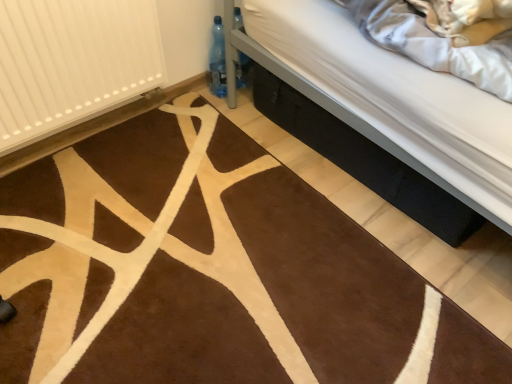
This screenshot has width=512, height=384. What do you see at coordinates (371, 91) in the screenshot?
I see `black fabric bed at lower right` at bounding box center [371, 91].

Identify the location of black fabric bed at lower right. (371, 91).

In order to face white ribbed radiator at left, should I rotate leftwards or rightwards?

You should rotate left by 22.180 degrees.

Measure the distance between point (58,4) and camera.

Point (58,4) and camera are 1.19 meters apart.

Where is `white ribbed radiator at left`? The height and width of the screenshot is (384, 512). white ribbed radiator at left is located at coordinates (72, 63).

Image resolution: width=512 pixels, height=384 pixels. What do you see at coordinates (72, 63) in the screenshot? I see `white ribbed radiator at left` at bounding box center [72, 63].

Locate an element on the screen. The width and height of the screenshot is (512, 384). black fabric bed at lower right is located at coordinates (371, 91).

From the picture: Considering the positions of objects black fabric bed at lower right and white ribbed radiator at left in the image provided, who is more to the left, black fabric bed at lower right or white ribbed radiator at left?

white ribbed radiator at left.

Who is more distant, black fabric bed at lower right or white ribbed radiator at left?

black fabric bed at lower right is behind.

Which is in front, point (304, 60) or point (32, 20)?

The point (32, 20) is closer to the camera.

From the image's perspective, between black fabric bed at lower right and white ribbed radiator at left, which one is located above?

white ribbed radiator at left appears higher in the image.

From a real-world perspective, relative to white ribbed radiator at left, is black fabric bed at lower right vertically above or below?

From a real-world perspective, black fabric bed at lower right is physically below white ribbed radiator at left.

Which object is thinner, black fabric bed at lower right or white ribbed radiator at left?

Thinner between the two is white ribbed radiator at left.

Can you confirm if black fabric bed at lower right is taller than white ribbed radiator at left?

Incorrect, the height of black fabric bed at lower right is not larger of that of white ribbed radiator at left.

From the picture: Does black fabric bed at lower right have a larger size compared to white ribbed radiator at left?

Yes, black fabric bed at lower right is bigger than white ribbed radiator at left.

Is white ribbed radiator at left completely or partially inside black fabric bed at lower right?

No, black fabric bed at lower right does not contain white ribbed radiator at left.

Is black fabric bed at lower right directly adjacent to white ribbed radiator at left?

No, black fabric bed at lower right is not next to white ribbed radiator at left.

Is black fabric bed at lower right turned away from white ribbed radiator at left?

No.

You are a GUI agent. You are given a task and a screenshot of the screen. Output one action in this format:
    pyautogui.click(x=<x>, y=<y>)
    Task: Click on the radiator that is above the black fabric bed at lower right (from a real-world perspective)
    This screenshot has height=384, width=512.
    Given the screenshot: What is the action you would take?
    pyautogui.click(x=72, y=63)

Which object is positioned more to the left, white ribbed radiator at left or black fabric bed at lower right?

From the viewer's perspective, white ribbed radiator at left appears more on the left side.

Which object is closer to the camera taking this photo, white ribbed radiator at left or black fabric bed at lower right?

Positioned in front is white ribbed radiator at left.

Does point (9, 12) come farther from viewer compared to point (322, 81)?

No.

From the image's perspective, is white ribbed radiator at left above black fabric bed at lower right?

Yes, from the image's perspective, white ribbed radiator at left is above black fabric bed at lower right.

From a real-world perspective, between white ribbed radiator at left and black fabric bed at lower right, who is vertically higher?

white ribbed radiator at left.

Looking at this image, between white ribbed radiator at left and black fabric bed at lower right, which one has larger width?

Wider between the two is black fabric bed at lower right.

Who is taller, white ribbed radiator at left or black fabric bed at lower right?

white ribbed radiator at left.

Consider the image. Between white ribbed radiator at left and black fabric bed at lower right, which one has larger size?

black fabric bed at lower right.

Is white ribbed radiator at left inside the boundaries of black fabric bed at lower right, or outside?

white ribbed radiator at left is not enclosed by black fabric bed at lower right.

Is white ribbed radiator at left touching black fabric bed at lower right?

No, white ribbed radiator at left is not touching black fabric bed at lower right.

Could you tell me if white ribbed radiator at left is facing black fabric bed at lower right?

No.

How many degrees apart are the facing directions of white ribbed radiator at left and black fabric bed at lower right?

There is a 87-degree angle between the facing directions of white ribbed radiator at left and black fabric bed at lower right.

Find the location of a particular element. This screenshot has width=512, height=384. radiator in front of the black fabric bed at lower right is located at coordinates (72, 63).

The height and width of the screenshot is (384, 512). Identify the location of bed below the white ribbed radiator at left (from a real-world perspective). (371, 91).

The width and height of the screenshot is (512, 384). In order to click on radiator that is above the black fabric bed at lower right (from a real-world perspective) in this screenshot , I will do click(72, 63).